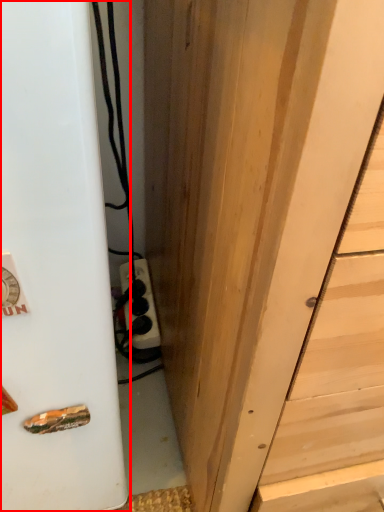
Question: In this image, where is appliance (annotated by the red box) located relative to door?

Choices:
 (A) left
 (B) right

Answer: (A)